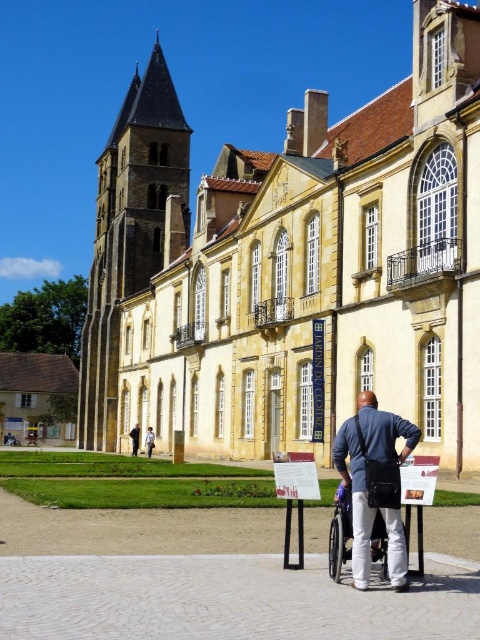
Question: Can you confirm if beige stone palace at center is wider than blue shirt at center?

Choices:
 (A) yes
 (B) no

Answer: (A)

Question: Observing the image, what is the correct spatial positioning of brown wooden house at lower left in reference to blue shirt at center?

Choices:
 (A) above
 (B) below

Answer: (B)

Question: Which point is farther to the camera?

Choices:
 (A) matte blue shirt at center
 (B) brown wooden house at lower left

Answer: (B)

Question: Which object is positioned closest to the matte blue shirt at center?

Choices:
 (A) brown wooden house at lower left
 (B) blue shirt at center
 (C) beige stone palace at center
 (D) dark blue fabric at center

Answer: (B)

Question: Is matte blue shirt at center smaller than brown wooden house at lower left?

Choices:
 (A) yes
 (B) no

Answer: (A)

Question: Estimate the real-world distances between objects in this image. Which object is closer to the beige stone palace at center?

Choices:
 (A) brown wooden house at lower left
 (B) dark blue fabric at center
 (C) blue shirt at center

Answer: (B)